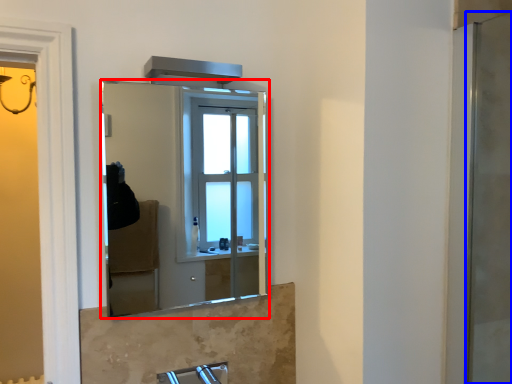
Question: Which point is further to the camera, mirror (highlighted by a red box) or screen door (highlighted by a blue box)?

Choices:
 (A) mirror
 (B) screen door

Answer: (A)